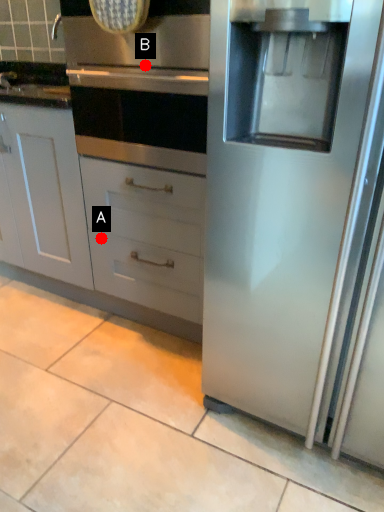
Question: Two points are circled on the image, labeled by A and B beside each circle. Which point is closer to the camera?

Choices:
 (A) A is closer
 (B) B is closer

Answer: (B)